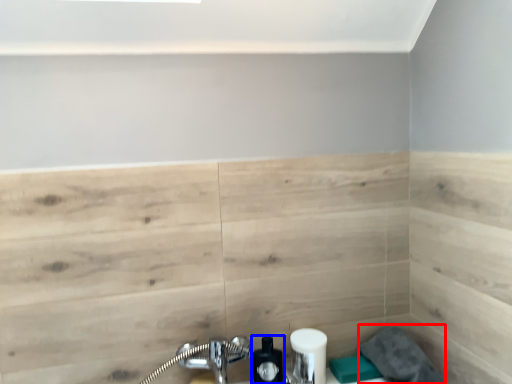
Question: Which of the following is the closest to the observer, gray (highlighted by a red box) or soap dispenser (highlighted by a blue box)?

Choices:
 (A) gray
 (B) soap dispenser

Answer: (A)